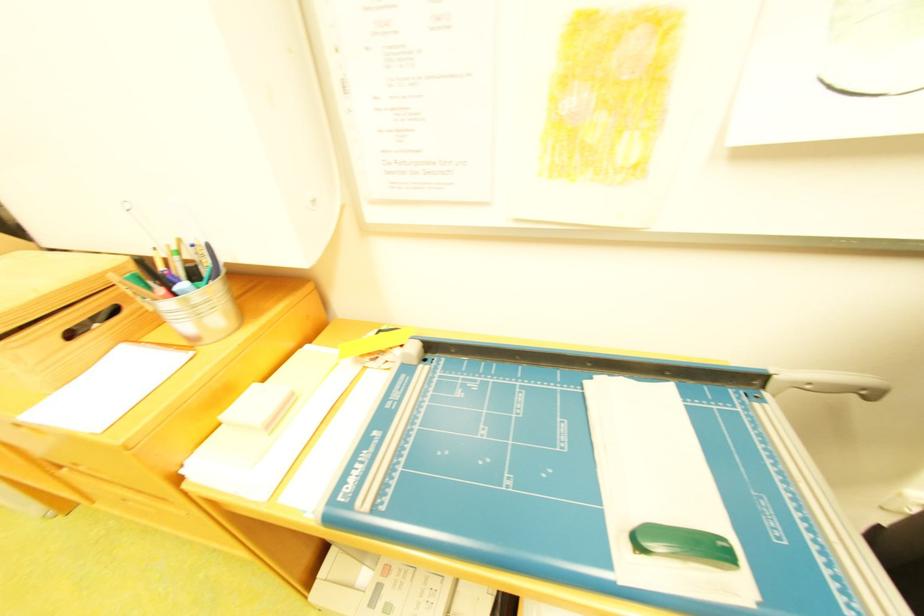
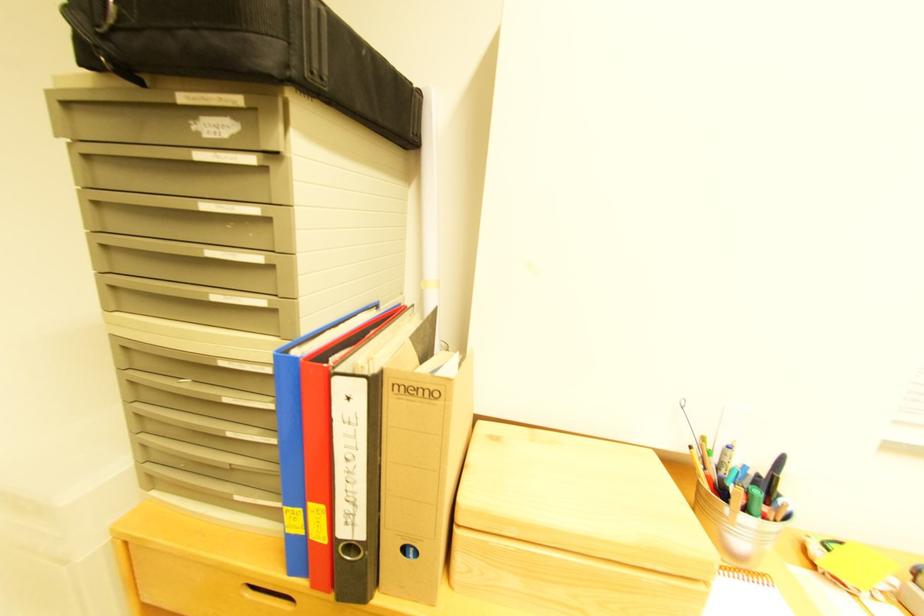
Question: In a continuous first-person perspective shot, in which direction is the camera moving?

Choices:
 (A) Left
 (B) Right
 (C) Forward
 (D) Backward

Answer: (A)